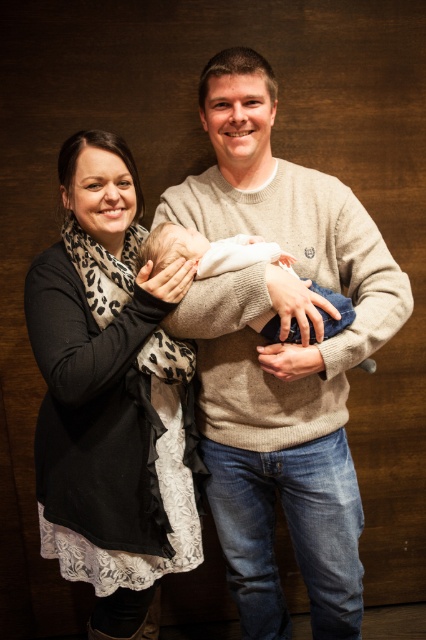
You are a photographer standing 1.5 meters away from the camera. You want to adjust the focus ring on the knit sweater at center. Can you reach it without moving closer?

The distance between the knit sweater at center and the camera is 1.33 meters. Since you are 1.5 meters away from the camera, the total distance to the knit sweater at center would be 1.33 meters plus your position, making it 2.83 meters away. This distance is too far to reach the sweater without moving closer.